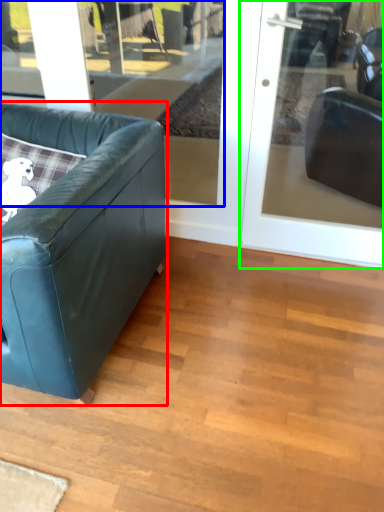
Question: Which is farther away from studio couch (highlighted by a red box)? window (highlighted by a blue box) or door (highlighted by a green box)?

Choices:
 (A) window
 (B) door

Answer: (A)